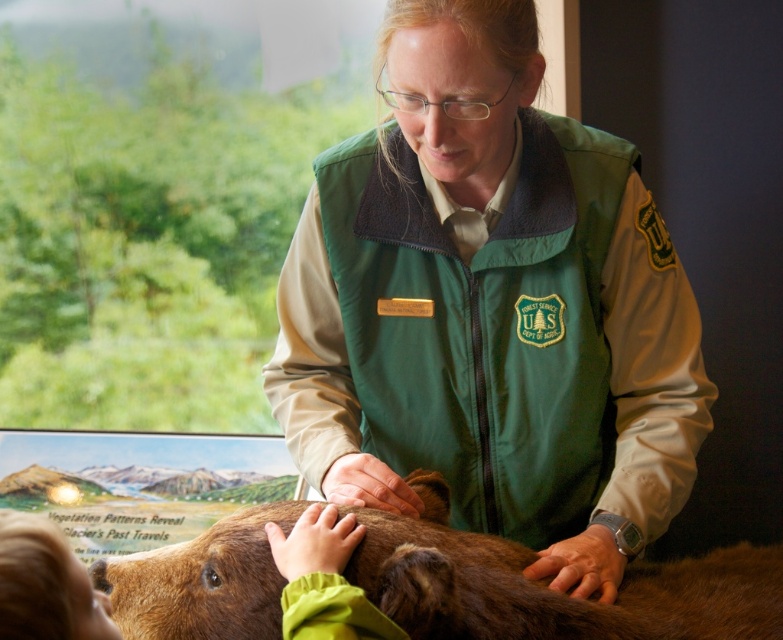
You are standing in front of the table where the stuffed bear is displayed. There are two points marked on the table surface at coordinates point (x=547, y=314) and point (x=540, y=586). If you were to place a small sticker on each of these points, which point would require you to reach closer to the edge of the table?

Point (x=540, y=586) would require reaching closer to the edge of the table since it is farther from the camera compared to point (x=547, y=314).